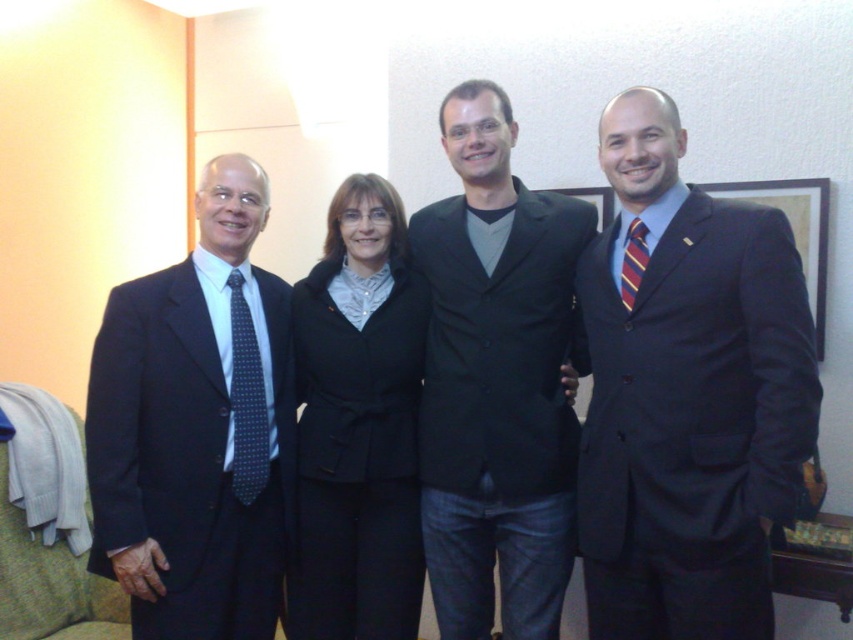
Question: Which object appears closest to the camera in this image?

Choices:
 (A) matte black suit at right
 (B) satin black suit at right
 (C) black matte blazer at center
 (D) dark blue dotted tie at left

Answer: (A)

Question: Is matte black suit at left above dark blue dotted tie at left?

Choices:
 (A) no
 (B) yes

Answer: (A)

Question: Is black matte suit at center positioned behind striped fabric tie at right?

Choices:
 (A) yes
 (B) no

Answer: (A)

Question: Which object is the farthest from the black matte blazer at center?

Choices:
 (A) black matte suit at center
 (B) black fabric picture frame at center

Answer: (B)

Question: Among these points, which one is farthest from the camera?

Choices:
 (A) (718, 509)
 (B) (552, 440)

Answer: (B)

Question: Can you confirm if matte black suit at right is positioned below dark blue dotted tie at left?

Choices:
 (A) yes
 (B) no

Answer: (B)